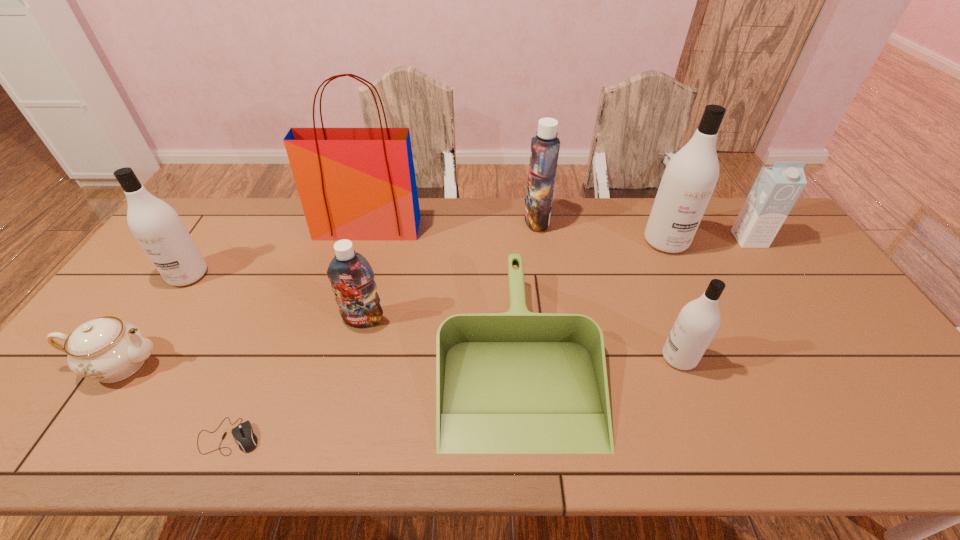
The height and width of the screenshot is (540, 960). What are the coordinates of `vacant space situated on the front-facing side of the third nearest shampoo` in the screenshot? It's located at 108,396.

Locate an element on the screen. This screenshot has width=960, height=540. vacant space positioned 0.180m on the front label of the rightmost object is located at coordinates [781, 288].

I want to click on vacant space located 0.300m on the front-facing side of the smallest white shampoo, so click(544, 357).

The image size is (960, 540). I want to click on free location located 0.140m on the front-facing side of the smallest white shampoo, so click(607, 357).

The width and height of the screenshot is (960, 540). In order to click on free space located 0.260m on the front-facing side of the smallest white shampoo in this screenshot , I will do `click(560, 357)`.

Image resolution: width=960 pixels, height=540 pixels. I want to click on vacant space situated 0.260m on the front label of the fourth farthest shampoo, so click(340, 418).

The width and height of the screenshot is (960, 540). I want to click on free location located 0.390m at the spout of the chinaware, so click(x=320, y=364).

Locate an element on the screen. This screenshot has width=960, height=540. vacant space located 0.180m on the back of the computer mouse is located at coordinates (264, 353).

Where is `shopping bag present at the far edge`? The width and height of the screenshot is (960, 540). shopping bag present at the far edge is located at coordinates (354, 183).

Locate an element on the screen. carton that is positioned at the far edge is located at coordinates (776, 189).